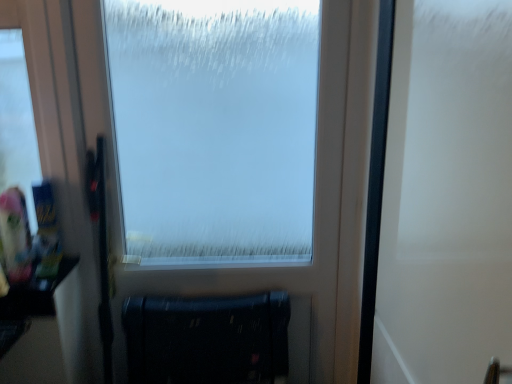
This screenshot has height=384, width=512. What do you see at coordinates (207, 339) in the screenshot?
I see `matte black radiator at lower center` at bounding box center [207, 339].

I want to click on frosted glass window at center, so click(x=315, y=195).

Is matte black radiator at lower center taller than frosted glass window at center?

Incorrect, the height of matte black radiator at lower center is not larger of that of frosted glass window at center.

I want to click on window on the right side of matte black radiator at lower center, so click(315, 195).

Relative to frosted glass window at center, is matte black radiator at lower center in front or behind?

Visually, matte black radiator at lower center is located behind frosted glass window at center.

Consider the image. Could you tell me if matte black radiator at lower center is facing frosted glass window at center?

No, matte black radiator at lower center is not facing towards frosted glass window at center.

How different are the orientations of white matte screen door at right and matte black radiator at lower center in degrees?

93.1 degrees.

Between white matte screen door at right and matte black radiator at lower center, which one has larger width?

With larger width is matte black radiator at lower center.

Can matte black radiator at lower center be found inside white matte screen door at right?

No.

Consider the image. Considering the relative positions of white matte screen door at right and matte black radiator at lower center in the image provided, is white matte screen door at right to the left or to the right of matte black radiator at lower center?

Based on their positions, white matte screen door at right is located to the right of matte black radiator at lower center.

Is matte black radiator at lower center not within white matte screen door at right?

matte black radiator at lower center is positioned outside white matte screen door at right.

Considering the sizes of objects matte black radiator at lower center and white matte screen door at right in the image provided, who is shorter, matte black radiator at lower center or white matte screen door at right?

With less height is matte black radiator at lower center.

Identify the location of window in front of the matte black radiator at lower center. (315, 195).

From a real-world perspective, which object stands above the other?

frosted glass window at center.

Is frosted glass window at center facing towards matte black radiator at lower center?

Yes, frosted glass window at center is oriented towards matte black radiator at lower center.

Is frosted glass window at center wider than matte black radiator at lower center?

No, frosted glass window at center is not wider than matte black radiator at lower center.

Considering the sizes of white matte screen door at right and frosted glass window at center in the image, is white matte screen door at right taller or shorter than frosted glass window at center?

Considering their sizes, white matte screen door at right has less height than frosted glass window at center.

From a real-world perspective, which object rests below the other?

In real-world perspective, frosted glass window at center is lower.

From the image's perspective, is white matte screen door at right below frosted glass window at center?

Yes, from the image's perspective, white matte screen door at right is beneath frosted glass window at center.

Looking at this image, is the surface of white matte screen door at right in direct contact with frosted glass window at center?

No, white matte screen door at right is not making contact with frosted glass window at center.

The height and width of the screenshot is (384, 512). In order to click on screen door on the right of frosted glass window at center in this screenshot , I will do `click(446, 196)`.

From the image's perspective, is frosted glass window at center above white matte screen door at right?

Indeed, from the image's perspective, frosted glass window at center is shown above white matte screen door at right.

Is frosted glass window at center shorter than white matte screen door at right?

No.

From a real-world perspective, is frosted glass window at center positioned under white matte screen door at right based on gravity?

Indeed, from a real-world perspective, frosted glass window at center is positioned beneath white matte screen door at right.

At what (x,y) coordinates should I click in order to perform the action: click on window that is in front of the matte black radiator at lower center. Please return your answer as a coordinate pair (x, y). Looking at the image, I should click on (315, 195).

Locate an element on the screen. furniture behind the white matte screen door at right is located at coordinates (207, 339).

Consider the image. Considering their positions, is matte black radiator at lower center positioned further to frosted glass window at center than white matte screen door at right?

white matte screen door at right is positioned further to the anchor frosted glass window at center.

In the scene shown: Which object lies further to the anchor point frosted glass window at center, white matte screen door at right or matte black radiator at lower center?

white matte screen door at right.

Estimate the real-world distances between objects in this image. Which object is further from matte black radiator at lower center, white matte screen door at right or frosted glass window at center?

Among the two, white matte screen door at right is located further to matte black radiator at lower center.

In the scene shown: Looking at the image, which one is located closer to white matte screen door at right, matte black radiator at lower center or frosted glass window at center?

frosted glass window at center is positioned closer to the anchor white matte screen door at right.

Considering their positions, is frosted glass window at center positioned further to matte black radiator at lower center than white matte screen door at right?

white matte screen door at right.

Looking at the image, which one is located further to white matte screen door at right, frosted glass window at center or matte black radiator at lower center?

matte black radiator at lower center lies further to white matte screen door at right than the other object.

I want to click on window positioned between white matte screen door at right and matte black radiator at lower center from near to far, so click(315, 195).